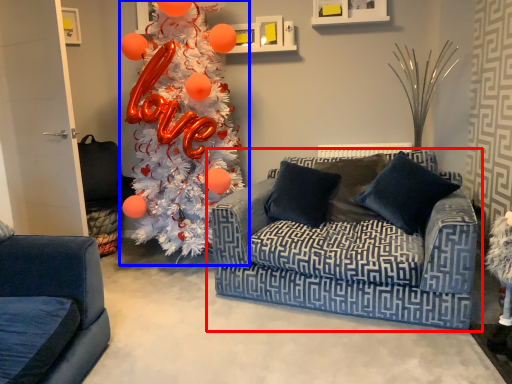
Question: Which of the following is the closest to the observer, studio couch (highlighted by a red box) or christmas tree (highlighted by a blue box)?

Choices:
 (A) studio couch
 (B) christmas tree

Answer: (A)